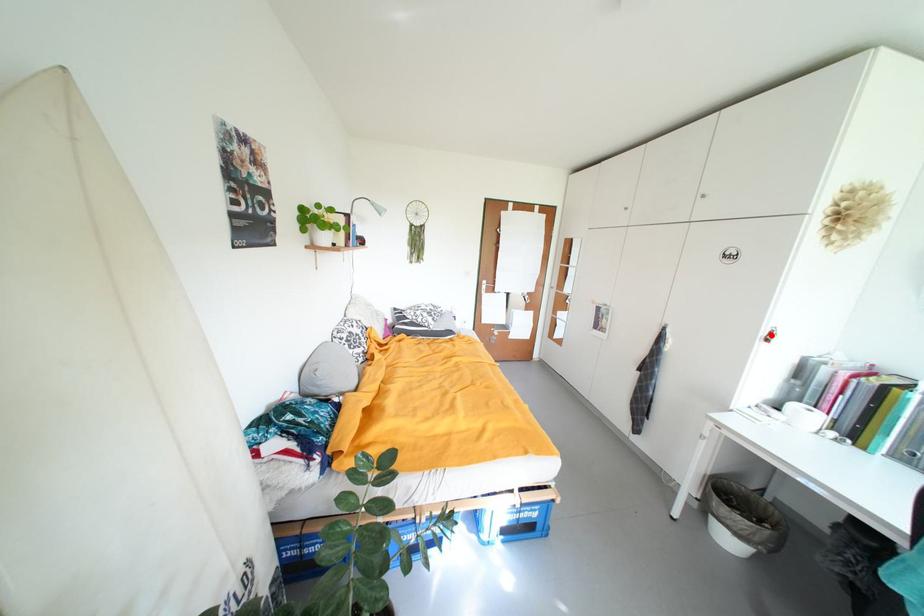
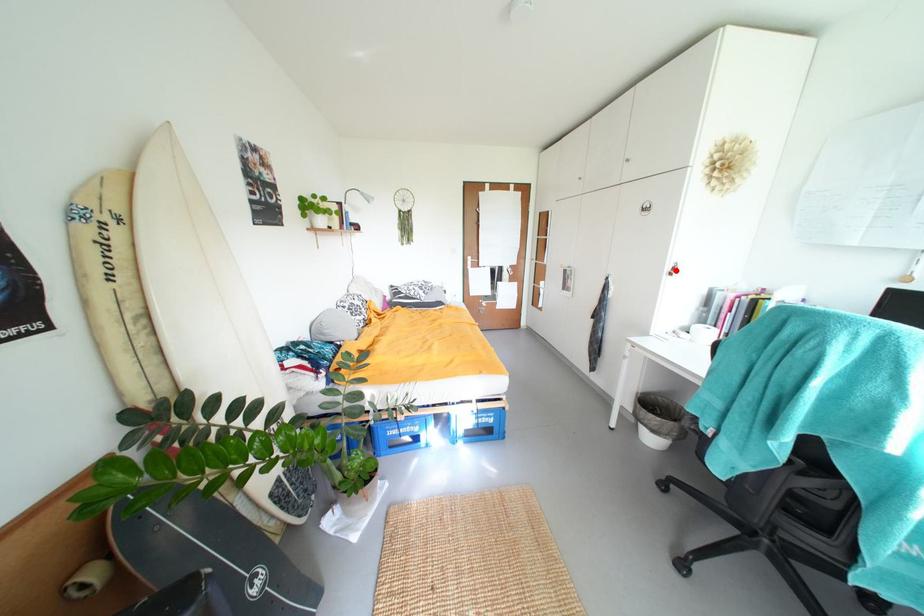
I am providing you with two images of the same scene from different viewpoints. A red point is marked on the first image and another point is marked on the second image. Is the red point in image1 aligned with the point shown in image2?

Yes